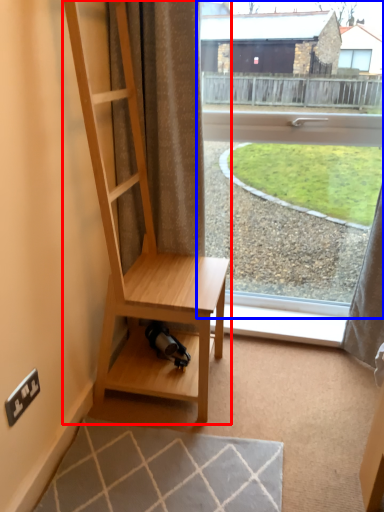
Question: Which of the following is the farthest to the observer, shelf (highlighted by a red box) or window (highlighted by a blue box)?

Choices:
 (A) shelf
 (B) window

Answer: (B)